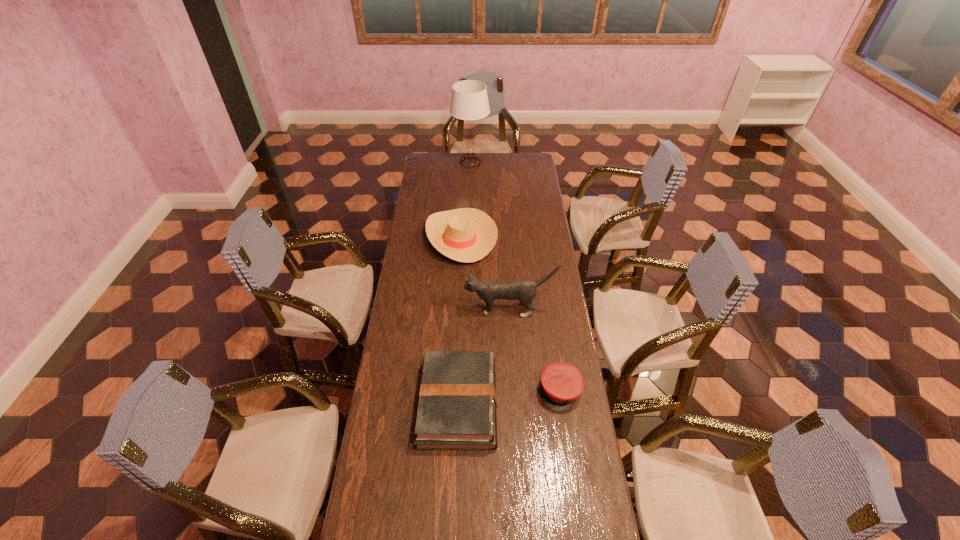
Find the location of `vacant point located between the hardback book and the second farthest object`. vacant point located between the hardback book and the second farthest object is located at coordinates (460, 320).

Locate an element on the screen. This screenshot has height=540, width=960. free space between the sunhat and the table lamp is located at coordinates (467, 200).

Select which object appears as the closest to the fourth shortest object. Please provide its 2D coordinates. Your answer should be formatted as a tuple, i.e. [(x, y)], where the tuple contains the x and y coordinates of a point satisfying the conditions above.

[(467, 235)]

Where is `the third closest object to the sunhat`? Image resolution: width=960 pixels, height=540 pixels. the third closest object to the sunhat is located at coordinates (457, 402).